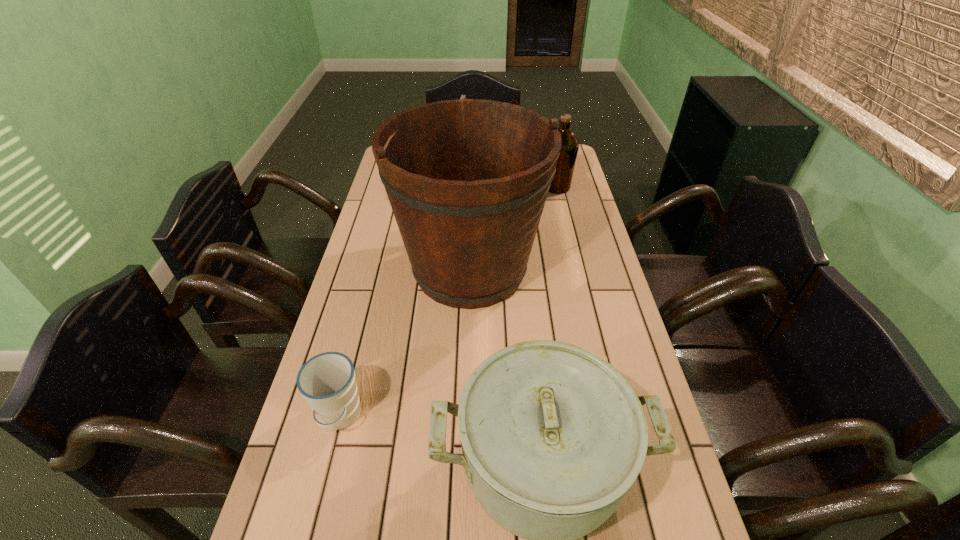
I want to click on bucket, so click(x=467, y=179).

I want to click on the third nearest object, so click(x=467, y=179).

Locate an element on the screen. The height and width of the screenshot is (540, 960). lantern is located at coordinates (463, 96).

Image resolution: width=960 pixels, height=540 pixels. I want to click on olive oil, so coord(561,183).

You are a GUI agent. You are given a task and a screenshot of the screen. Output one action in this format:
    pyautogui.click(x=<x>, y=<y>)
    Task: Click on the cup
    This screenshot has width=960, height=540.
    Given the screenshot: What is the action you would take?
    pyautogui.click(x=327, y=381)

Where is `vacant space positioned on the back of the third farthest object`? Image resolution: width=960 pixels, height=540 pixels. vacant space positioned on the back of the third farthest object is located at coordinates (471, 192).

Image resolution: width=960 pixels, height=540 pixels. I want to click on blank space located 0.200m on the right of the lantern, so click(x=543, y=184).

Locate an element on the screen. Image resolution: width=960 pixels, height=540 pixels. vacant region located 0.180m on the label of the olive oil is located at coordinates (492, 187).

The height and width of the screenshot is (540, 960). Find the location of `vacant space located 0.070m on the label of the olive oil`. vacant space located 0.070m on the label of the olive oil is located at coordinates (521, 187).

This screenshot has height=540, width=960. Identify the location of vacant space situated 0.260m on the label of the olive oil. (469, 187).